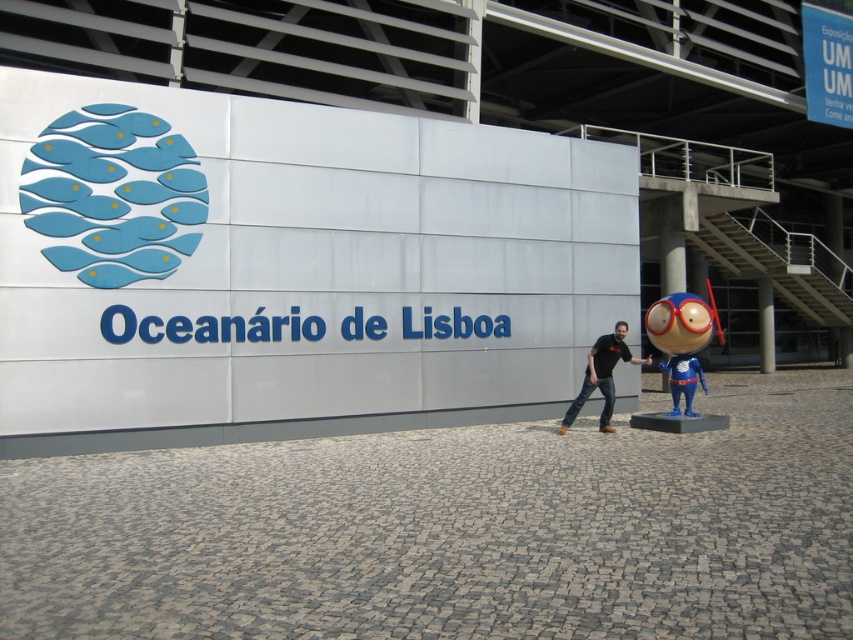
Question: Is blue glossy toy at right smaller than black matte shirt at center?

Choices:
 (A) no
 (B) yes

Answer: (A)

Question: Which point is farther to the camera?

Choices:
 (A) black matte shirt at center
 (B) blue glossy toy at right

Answer: (A)

Question: Is blue glossy toy at right to the left of black matte shirt at center from the viewer's perspective?

Choices:
 (A) yes
 (B) no

Answer: (B)

Question: Which point is farther to the camera?

Choices:
 (A) black matte shirt at center
 (B) blue glossy toy at right

Answer: (A)

Question: Among these objects, which one is farthest from the camera?

Choices:
 (A) blue glossy toy at right
 (B) black matte shirt at center

Answer: (B)

Question: Where is blue glossy toy at right located in relation to black matte shirt at center in the image?

Choices:
 (A) above
 (B) below

Answer: (A)